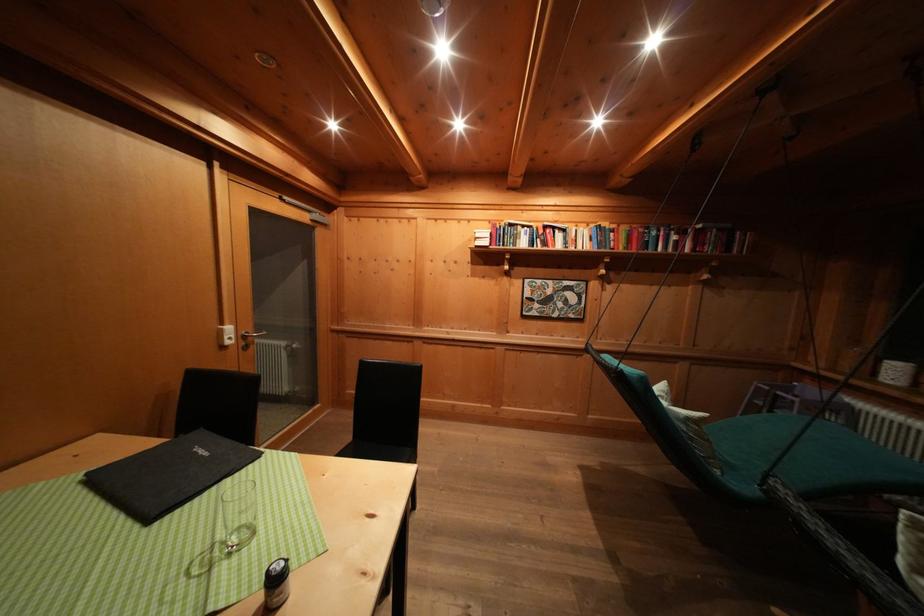
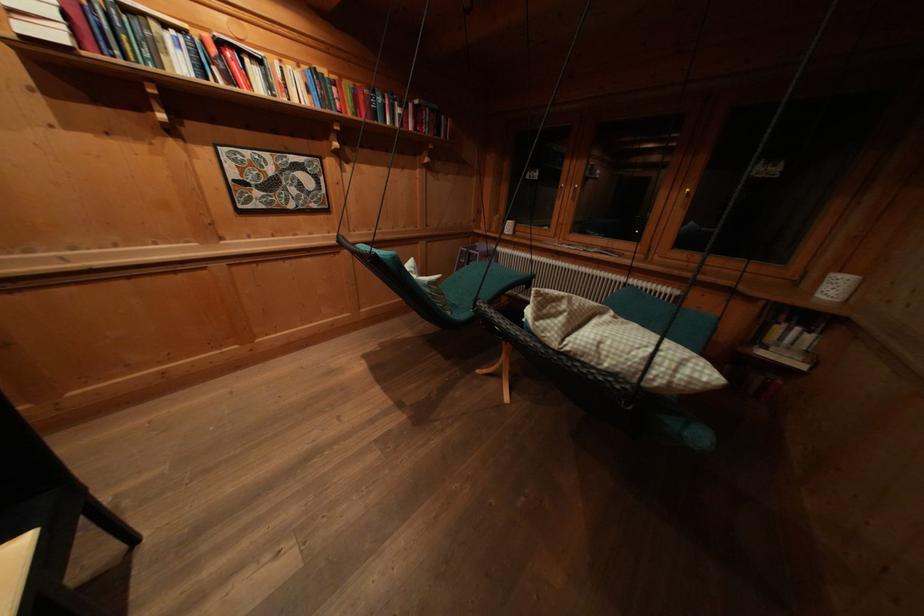
The point at (661, 238) is marked in the first image. Where is the corresponding point in the second image?

(385, 103)